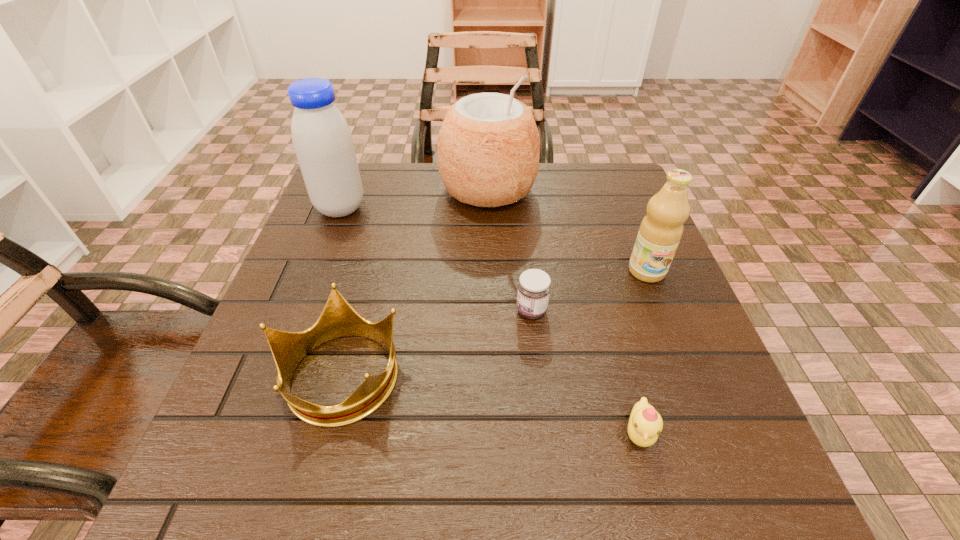
At what (x,y) coordinates should I click in order to perform the action: click on coconut. Please return your answer as a coordinate pair (x, y). This screenshot has width=960, height=540. Looking at the image, I should click on (488, 146).

Where is `soya milk`? soya milk is located at coordinates (322, 140).

The width and height of the screenshot is (960, 540). Identify the location of the third farthest object. (660, 232).

Locate an element on the screen. Image resolution: width=960 pixels, height=540 pixels. the third tallest object is located at coordinates (660, 232).

Locate an element on the screen. Image resolution: width=960 pixels, height=540 pixels. crown is located at coordinates [x=338, y=319].

Identify the location of jam. This screenshot has width=960, height=540. (534, 287).

I want to click on the second object from right to left, so click(x=645, y=424).

The height and width of the screenshot is (540, 960). Find the location of `free space located on the left of the coconut`. free space located on the left of the coconut is located at coordinates (380, 190).

The width and height of the screenshot is (960, 540). Find the location of `vacant space situated 0.200m on the right of the soya milk`. vacant space situated 0.200m on the right of the soya milk is located at coordinates (450, 208).

Where is `vacant area located 0.310m on the label of the rightmost object`? The width and height of the screenshot is (960, 540). vacant area located 0.310m on the label of the rightmost object is located at coordinates (711, 434).